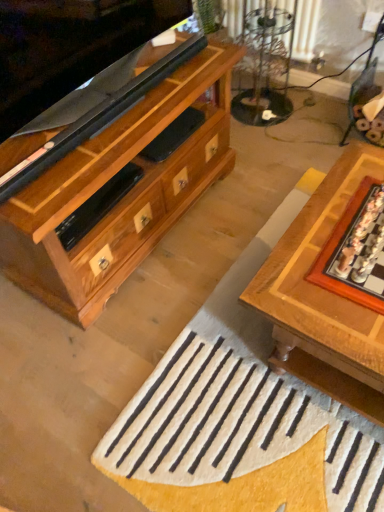
Find the location of a particular element. empty space that is ontop of wooden chessboard at center (from a real-world perspective) is located at coordinates (336, 249).